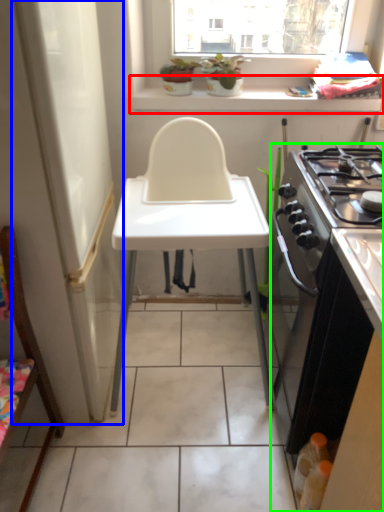
Question: Estimate the real-world distances between objects in this image. Which object is farther from window sill (highlighted by a red box), screen door (highlighted by a blue box) or cabinetry (highlighted by a green box)?

Choices:
 (A) screen door
 (B) cabinetry

Answer: (B)